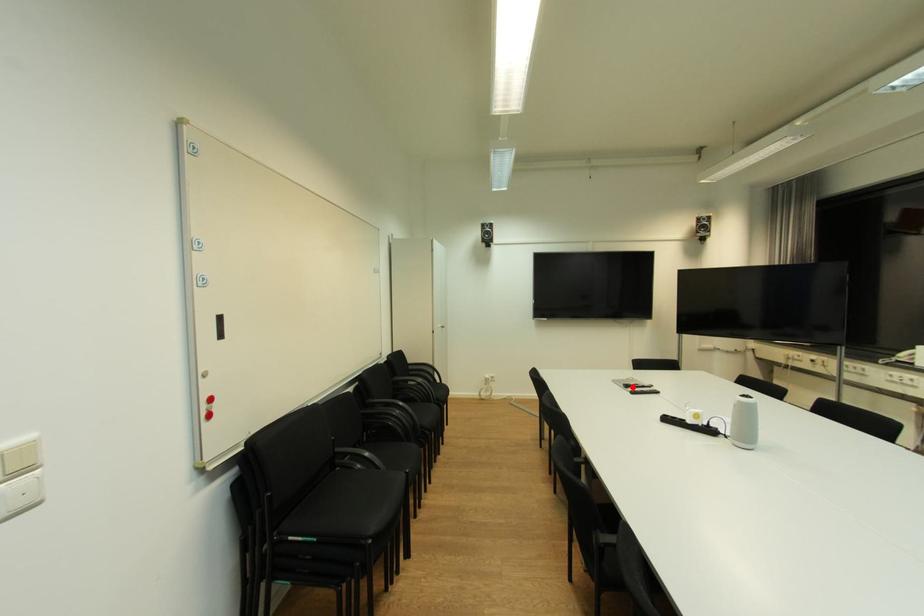
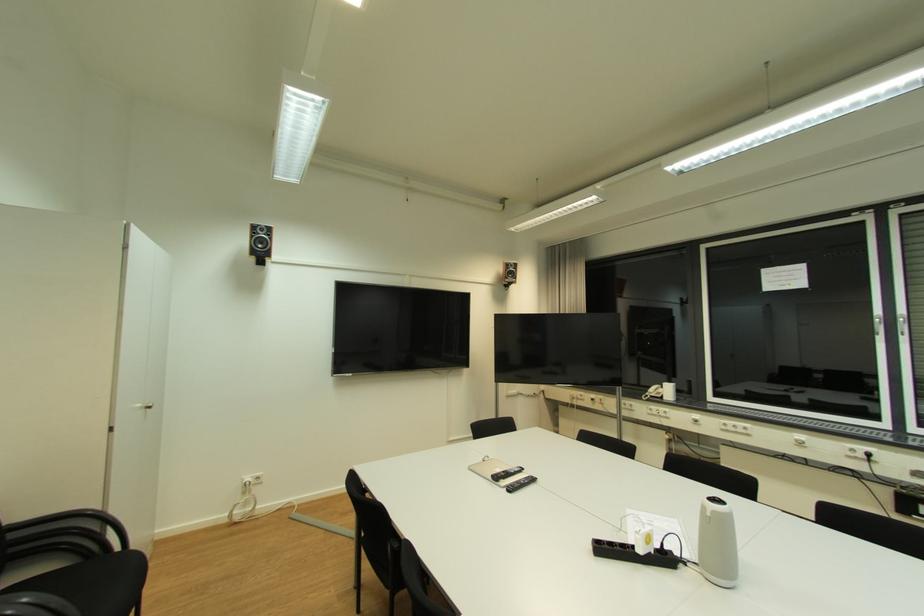
Find the pixel in the second image that matches the highlighted location in the first image.

(502, 479)